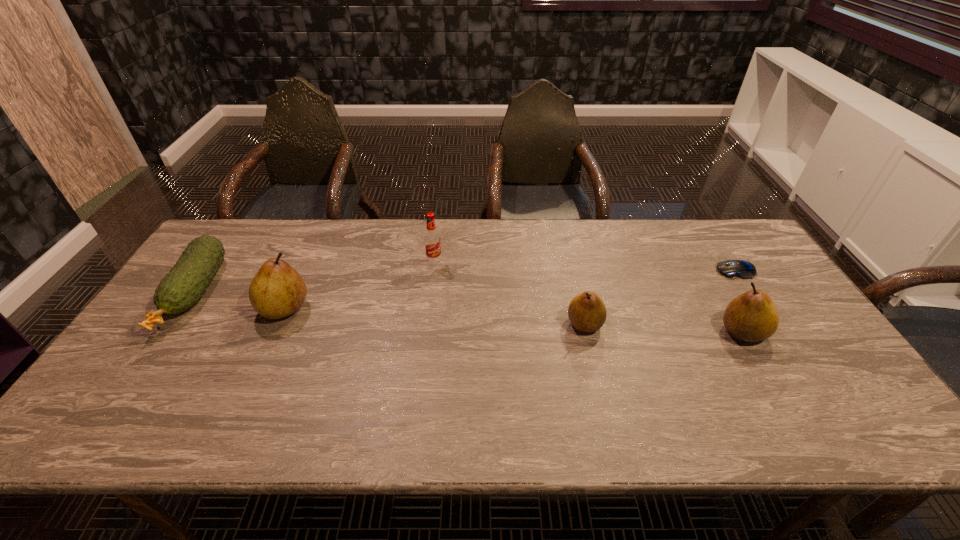
Where is `unoccupied area between the leftmost object and the root beer`? unoccupied area between the leftmost object and the root beer is located at coordinates coord(314,277).

Where is `free space between the computer mouse and the second object from left to right`? The height and width of the screenshot is (540, 960). free space between the computer mouse and the second object from left to right is located at coordinates (510, 289).

Where is `free space between the third object from right to left and the rightmost pear`? The height and width of the screenshot is (540, 960). free space between the third object from right to left and the rightmost pear is located at coordinates (663, 328).

Locate an element on the screen. This screenshot has height=540, width=960. vacant space that is in between the cucumber and the root beer is located at coordinates (314, 277).

Locate an element on the screen. The image size is (960, 540). empty space that is in between the computer mouse and the root beer is located at coordinates (585, 266).

Where is `free space that is in between the second pear from right to left and the computer mouse`? The image size is (960, 540). free space that is in between the second pear from right to left and the computer mouse is located at coordinates (660, 297).

The width and height of the screenshot is (960, 540). I want to click on free point between the second shortest object and the second shortest pear, so click(x=468, y=312).

At what (x,y) coordinates should I click in order to perform the action: click on unoccupied area between the third object from left to right and the leftmost object. Please return your answer as a coordinate pair (x, y). This screenshot has width=960, height=540. Looking at the image, I should click on (314, 277).

Identify the location of vacant space that is in between the computer mouse and the leftmost pear. The width and height of the screenshot is (960, 540). (510, 289).

Select which object appears as the fourth closest to the root beer. Please provide its 2D coordinates. Your answer should be formatted as a tuple, i.e. [(x, y)], where the tuple contains the x and y coordinates of a point satisfying the conditions above.

[(752, 316)]